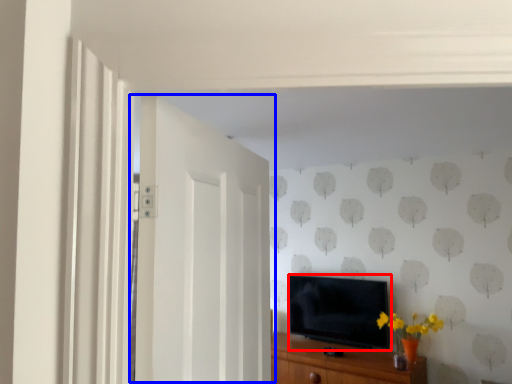
Question: Which of the following is the farthest to the observer, television (highlighted by a red box) or door (highlighted by a blue box)?

Choices:
 (A) television
 (B) door

Answer: (A)